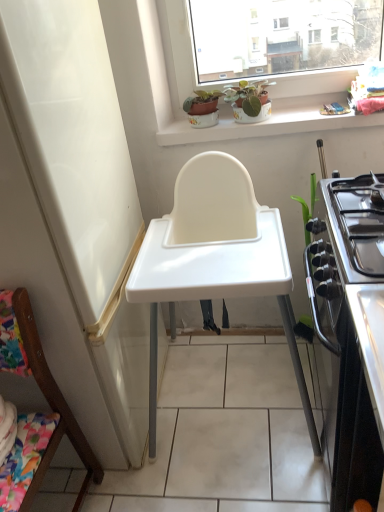
Question: Is matte ceramic pot at upper center, marked as the 2th houseplant in a right-to-left arrangement, thinner than green matte plant at upper center, acting as the 2th houseplant starting from the left?

Choices:
 (A) no
 (B) yes

Answer: (B)

Question: Is matte ceramic pot at upper center, which ranks as the first houseplant in left-to-right order, directly adjacent to green matte plant at upper center, marked as the 1th houseplant in a right-to-left arrangement?

Choices:
 (A) no
 (B) yes

Answer: (A)

Question: From the image's perspective, is matte ceramic pot at upper center, marked as the 2th houseplant in a right-to-left arrangement, located beneath green matte plant at upper center, acting as the 2th houseplant starting from the left?

Choices:
 (A) yes
 (B) no

Answer: (B)

Question: Is green matte plant at upper center, marked as the 1th houseplant in a right-to-left arrangement, a part of matte ceramic pot at upper center, marked as the 2th houseplant in a right-to-left arrangement?

Choices:
 (A) yes
 (B) no

Answer: (B)

Question: Considering the relative positions of matte ceramic pot at upper center, which ranks as the first houseplant in left-to-right order, and green matte plant at upper center, marked as the 1th houseplant in a right-to-left arrangement, in the image provided, is matte ceramic pot at upper center, which ranks as the first houseplant in left-to-right order, to the left of green matte plant at upper center, marked as the 1th houseplant in a right-to-left arrangement, from the viewer's perspective?

Choices:
 (A) yes
 (B) no

Answer: (A)

Question: From a real-world perspective, relative to green matte plant at upper center, acting as the 2th houseplant starting from the left, is stainless steel stove at right vertically above or below?

Choices:
 (A) below
 (B) above

Answer: (A)

Question: Is point (364, 421) closer or farther from the camera than point (240, 116)?

Choices:
 (A) farther
 (B) closer

Answer: (B)

Question: Is stainless steel stove at right bigger or smaller than green matte plant at upper center, acting as the 2th houseplant starting from the left?

Choices:
 (A) big
 (B) small

Answer: (A)

Question: Looking at their shapes, would you say stainless steel stove at right is wider or thinner than green matte plant at upper center, acting as the 2th houseplant starting from the left?

Choices:
 (A) thin
 (B) wide

Answer: (B)

Question: Considering the positions of stainless steel stove at right and white plastic highchair at center in the image, is stainless steel stove at right taller or shorter than white plastic highchair at center?

Choices:
 (A) short
 (B) tall

Answer: (A)

Question: Considering the relative positions of stainless steel stove at right and white plastic highchair at center in the image provided, is stainless steel stove at right to the left or to the right of white plastic highchair at center?

Choices:
 (A) left
 (B) right

Answer: (B)

Question: In terms of width, does stainless steel stove at right look wider or thinner when compared to white plastic highchair at center?

Choices:
 (A) wide
 (B) thin

Answer: (B)

Question: Is point [x=375, y=258] positioned closer to the camera than point [x=203, y=262]?

Choices:
 (A) farther
 (B) closer

Answer: (B)

Question: Considering the positions of matte ceramic pot at upper center, which ranks as the first houseplant in left-to-right order, and green matte plant at upper center, marked as the 1th houseplant in a right-to-left arrangement, in the image, is matte ceramic pot at upper center, which ranks as the first houseplant in left-to-right order, bigger or smaller than green matte plant at upper center, marked as the 1th houseplant in a right-to-left arrangement,?

Choices:
 (A) big
 (B) small

Answer: (B)

Question: Is matte ceramic pot at upper center, which ranks as the first houseplant in left-to-right order, spatially inside green matte plant at upper center, marked as the 1th houseplant in a right-to-left arrangement, or outside of it?

Choices:
 (A) outside
 (B) inside

Answer: (A)